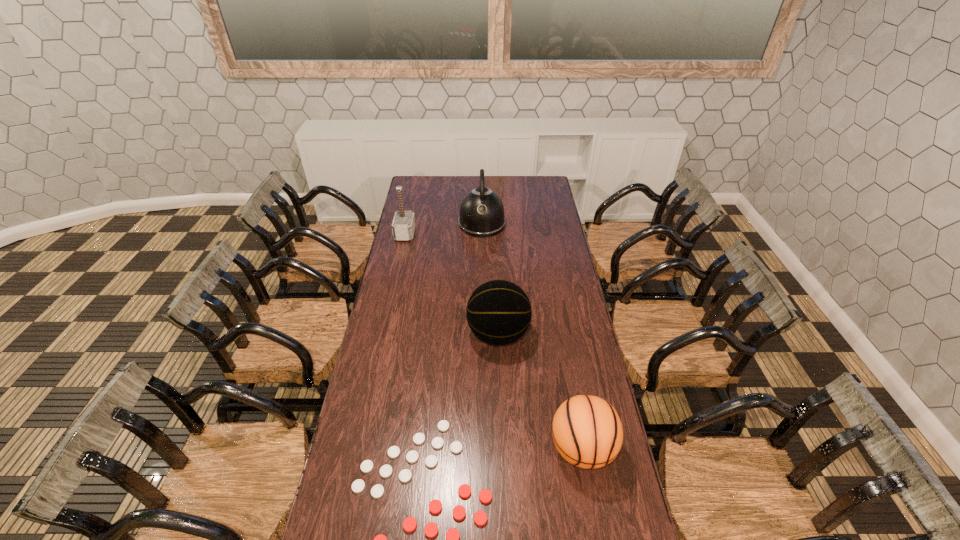
Locate an element on the screen. The width and height of the screenshot is (960, 540). kettle is located at coordinates (481, 212).

I want to click on hammer, so click(403, 226).

Locate an element on the screen. the third farthest object is located at coordinates (498, 312).

Find the location of `the left basketball`. the left basketball is located at coordinates (498, 312).

At what (x,y) coordinates should I click in order to perform the action: click on the shorter basketball. Please return your answer as a coordinate pair (x, y). This screenshot has height=540, width=960. Looking at the image, I should click on (587, 431).

Where is `the nearer basketball`? The width and height of the screenshot is (960, 540). the nearer basketball is located at coordinates (587, 431).

Identify the location of vacant point located 0.210m on the spout of the kettle. (482, 265).

Where is `free region located for striking with the head of the hammer`? free region located for striking with the head of the hammer is located at coordinates (484, 234).

I want to click on vacant space located 0.130m on the left of the taller basketball, so click(436, 334).

I want to click on free spot located 0.150m on the front of the rightmost object, so click(x=597, y=534).